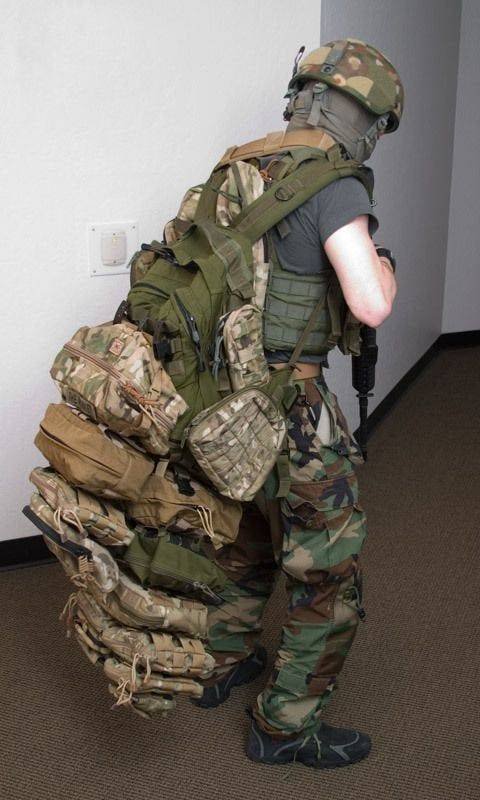
The image size is (480, 800). Identify the location of walls. (460, 281), (414, 230), (339, 377), (48, 242).